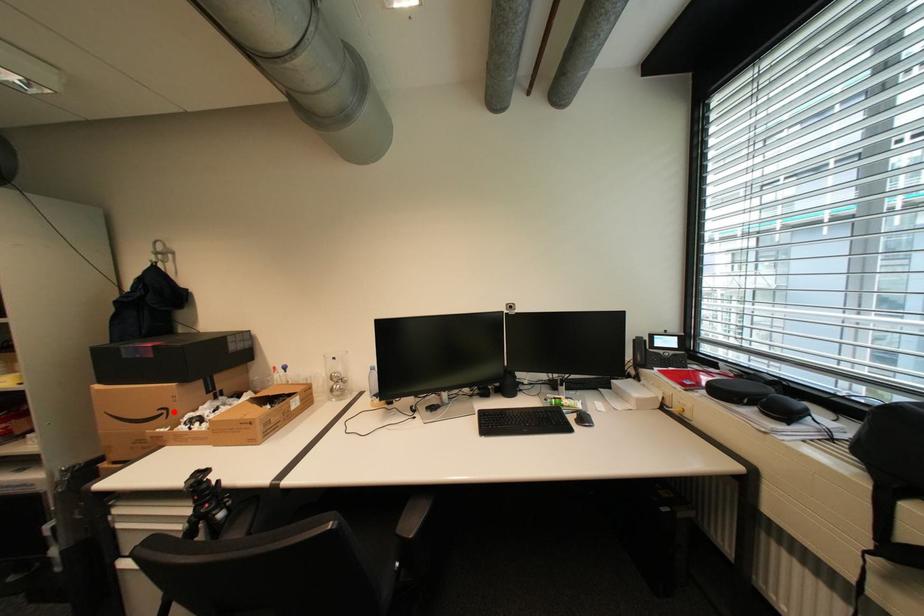
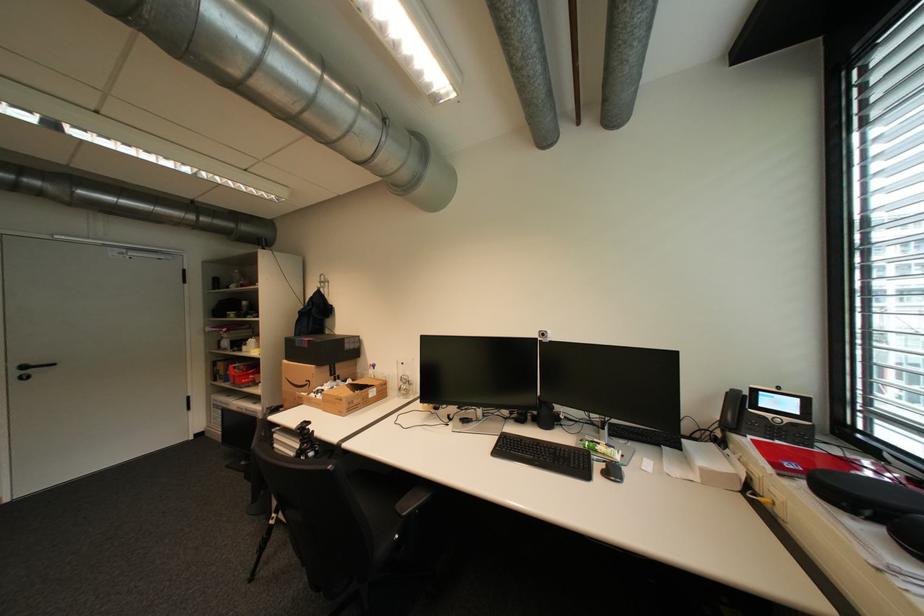
The point at the highlighted location is marked in the first image. Where is the corresponding point in the second image?

(317, 383)